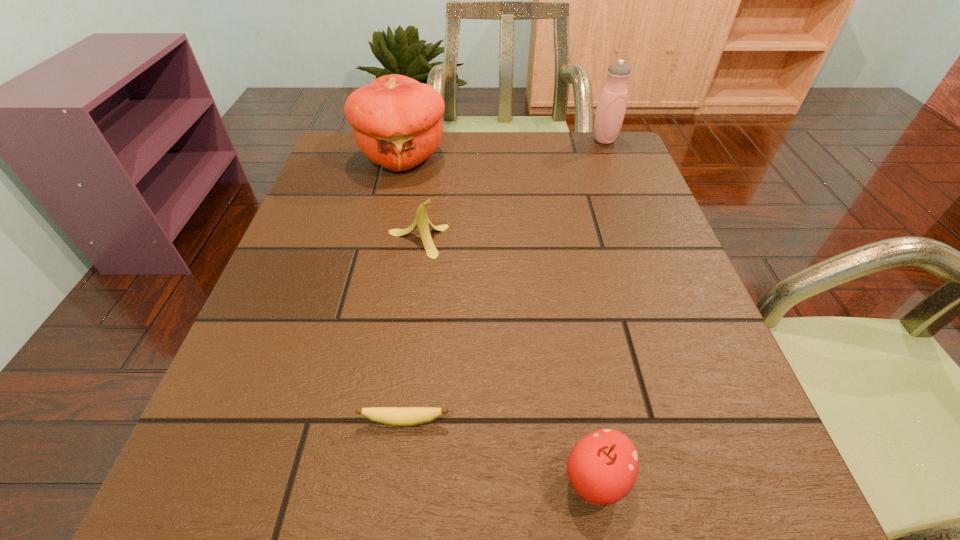
Where is `vacant area that lies between the taller banana and the second nearest object`? The image size is (960, 540). vacant area that lies between the taller banana and the second nearest object is located at coordinates (412, 331).

The image size is (960, 540). Find the location of `free spot between the third farthest object and the pumpkin`. free spot between the third farthest object and the pumpkin is located at coordinates (411, 199).

Locate an element on the screen. The height and width of the screenshot is (540, 960). vacant space that's between the fourth object from left to right and the taller banana is located at coordinates (508, 360).

The image size is (960, 540). What are the coordinates of `vacant space that's between the thermos bottle and the nearest object` in the screenshot? It's located at (600, 309).

Locate an element on the screen. free space between the taller banana and the pumpkin is located at coordinates (411, 199).

The width and height of the screenshot is (960, 540). Find the location of `vacant space in between the apple and the third farthest object`. vacant space in between the apple and the third farthest object is located at coordinates coord(508,360).

Find the location of `empty space that is in between the pumpkin and the nearest object`. empty space that is in between the pumpkin and the nearest object is located at coordinates (499, 318).

The width and height of the screenshot is (960, 540). What are the coordinates of `object that is the second nearest to the second object from right to left` in the screenshot? It's located at (422, 222).

Identify the location of object that stands as the fourth closest to the apple. This screenshot has height=540, width=960. (611, 107).

Find the location of `free region that satisfies the following two spatial constraints: 1. on the front side of the nearest object; 2. on the left side of the shortest object`. free region that satisfies the following two spatial constraints: 1. on the front side of the nearest object; 2. on the left side of the shortest object is located at coordinates (397, 478).